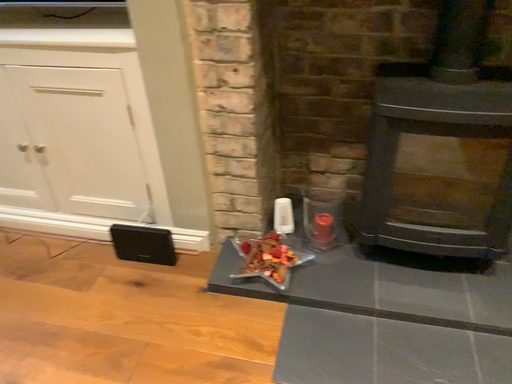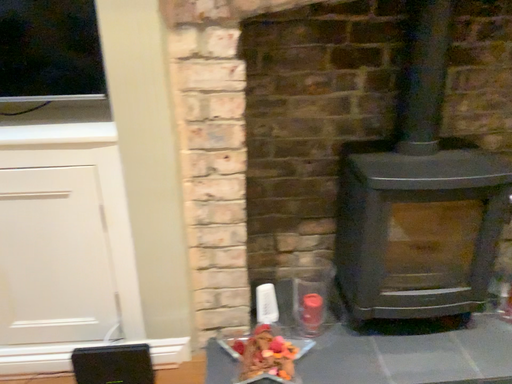
Question: How did the camera likely rotate when shooting the video?

Choices:
 (A) rotated downward
 (B) rotated upward

Answer: (B)